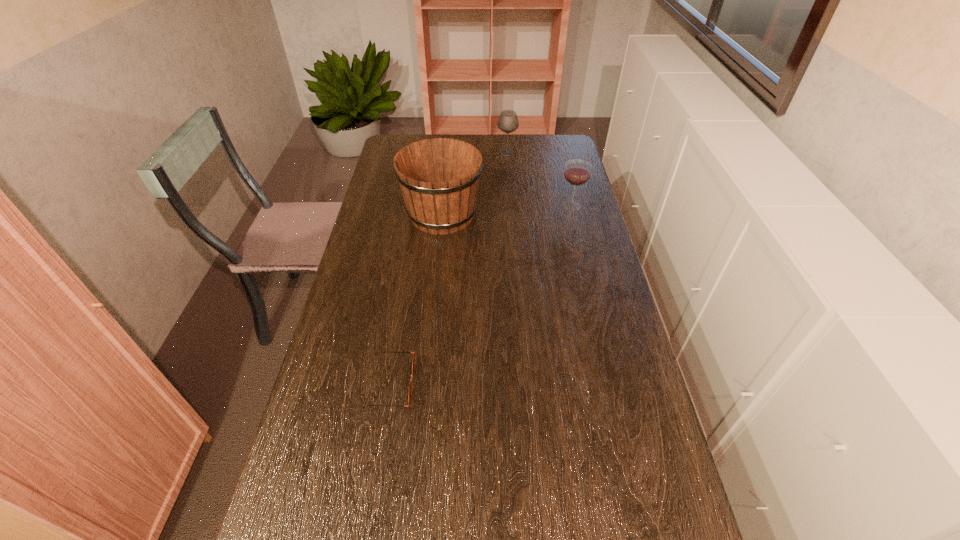
Find the location of `vacant space located on the face of the nearest object`. vacant space located on the face of the nearest object is located at coordinates (523, 383).

Find the location of a particular element. object situated at the far edge is located at coordinates (508, 122).

Identify the location of wine bucket located in the left edge section of the desktop. This screenshot has width=960, height=540. (439, 177).

You are a GUI agent. You are given a task and a screenshot of the screen. Output one action in this format:
    pyautogui.click(x=<x>, y=<y>)
    Task: Click on the sunglasses that is at the left edge
    This screenshot has width=960, height=540.
    Given the screenshot: What is the action you would take?
    pyautogui.click(x=414, y=356)

You are a GUI agent. You are given a task and a screenshot of the screen. Output one action in this format:
    pyautogui.click(x=<x>, y=<y>)
    Task: Click on the object that is at the right edge
    
    Given the screenshot: What is the action you would take?
    pyautogui.click(x=577, y=172)

You are a GUI agent. You are given a task and a screenshot of the screen. Output one action in this format:
    pyautogui.click(x=<x>, y=<y>)
    Task: Click on the vacant space at the far edge
    This screenshot has height=540, width=960.
    Given the screenshot: What is the action you would take?
    pyautogui.click(x=497, y=154)

I want to click on free region at the left edge of the desktop, so click(x=352, y=508).

Image resolution: width=960 pixels, height=540 pixels. In order to click on vacant space at the right edge of the desktop in this screenshot , I will do `click(618, 316)`.

This screenshot has width=960, height=540. In the image, there is a desktop. Identify the location of vacant space at the far right corner. (547, 145).

Where is `free space between the rightmost object and the farther wineglass`? free space between the rightmost object and the farther wineglass is located at coordinates pos(540,179).